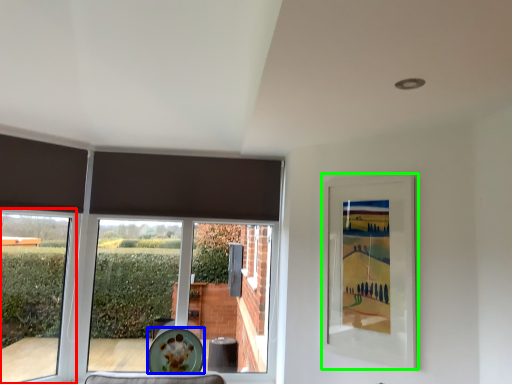
Question: Which is nearer to the window (highlighted by a red box)? plate (highlighted by a blue box) or picture frame (highlighted by a green box).

Choices:
 (A) plate
 (B) picture frame

Answer: (A)